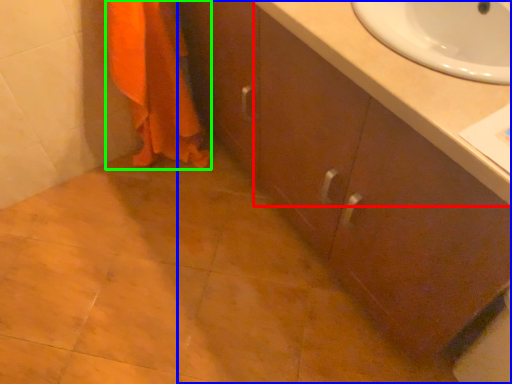
Question: Which object is the farthest from counter top (highlighted by a red box)? Choose among these: bathroom cabinet (highlighted by a blue box) or bath towel (highlighted by a green box).

Choices:
 (A) bathroom cabinet
 (B) bath towel

Answer: (B)